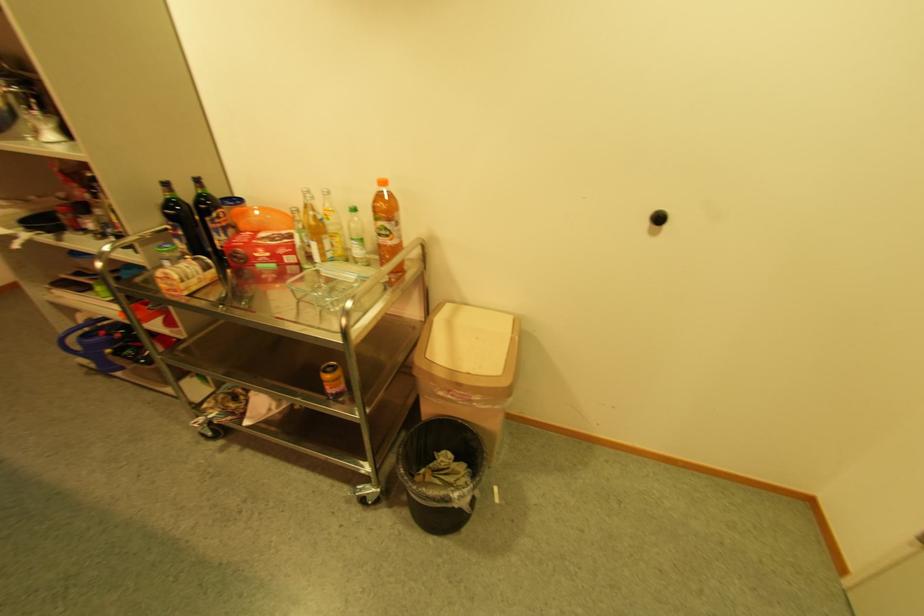
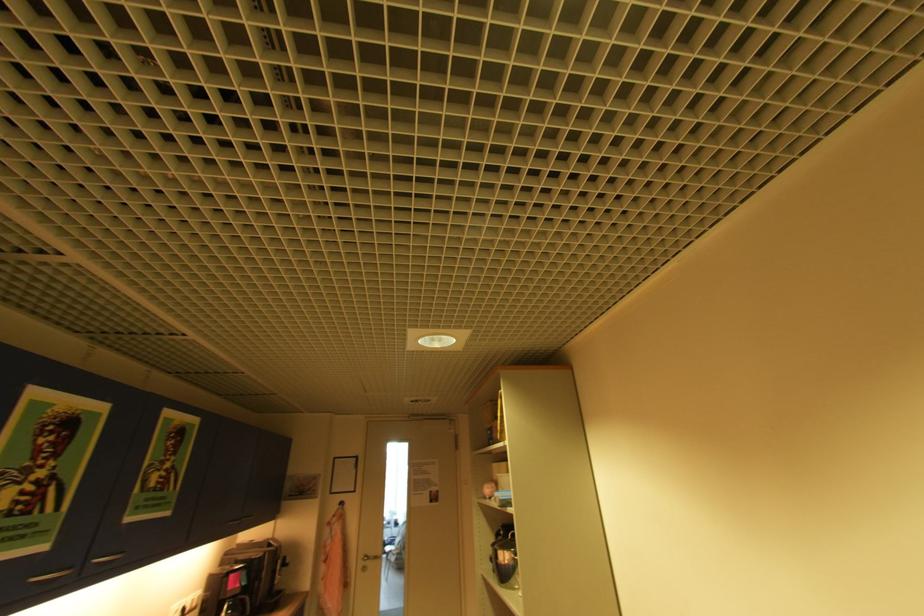
How did the camera likely rotate?

The camera rotated toward left-up.